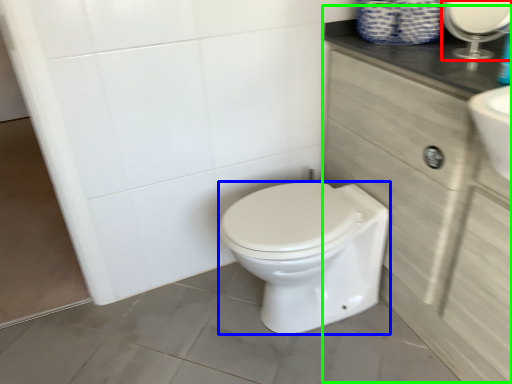
Question: Estimate the real-world distances between objects in this image. Which object is farther from mirror (highlighted by a red box), bidet (highlighted by a blue box) or cabinetry (highlighted by a green box)?

Choices:
 (A) bidet
 (B) cabinetry

Answer: (A)